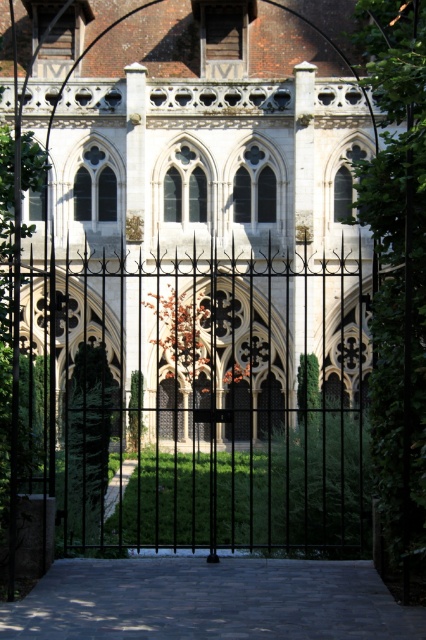
You are standing in front of the black wrought iron gate. The white stone church at center is your destination. According to the coordinates provided, is the church positioned to the left or right of the center point of the image?

The white stone church at center is located at point (199,202). Since the coordinates are based on a scale from 0 to 1, where 0.5 would be the exact center, the church is slightly to the left and below the center point of the image.

You are standing in front of the black wrought iron gate looking at the grand historic building. There are two points marked on the gate. One is at coordinate point[206,237] and the other at point[236,400]. Which point is closer to you?

Point[206,237] is closer to the camera than point[236,400].

You are standing in front of the black wrought iron gate at center and want to enter the white stone church at center. Which direction should you walk to reach the church from the gate?

The white stone church at center is to the right of the black wrought iron gate at center, so you should walk to the right to reach the church from the gate.